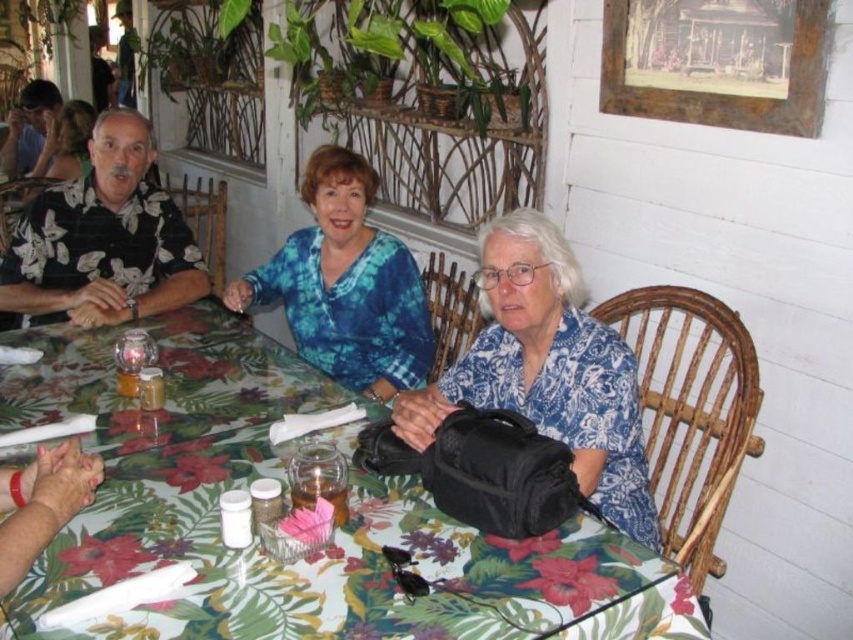
Question: Does floral-patterned tablecloth at center have a larger size compared to black fabric bag at center?

Choices:
 (A) yes
 (B) no

Answer: (A)

Question: Estimate the real-world distances between objects in this image. Which object is farther from the black fabric bag at center?

Choices:
 (A) blue tie-dye blouse at center
 (B) floral-patterned tablecloth at center

Answer: (A)

Question: Among these objects, which one is farthest from the camera?

Choices:
 (A) floral-patterned tablecloth at center
 (B) blue tie-dye blouse at center
 (C) black fabric bag at center

Answer: (B)

Question: Which point is closer to the camera?

Choices:
 (A) floral-patterned tablecloth at center
 (B) black fabric bag at center

Answer: (A)

Question: Does floral-patterned tablecloth at center come behind blue tie-dye blouse at center?

Choices:
 (A) yes
 (B) no

Answer: (B)

Question: Does black fabric bag at center appear on the right side of blue tie-dye blouse at center?

Choices:
 (A) no
 (B) yes

Answer: (B)